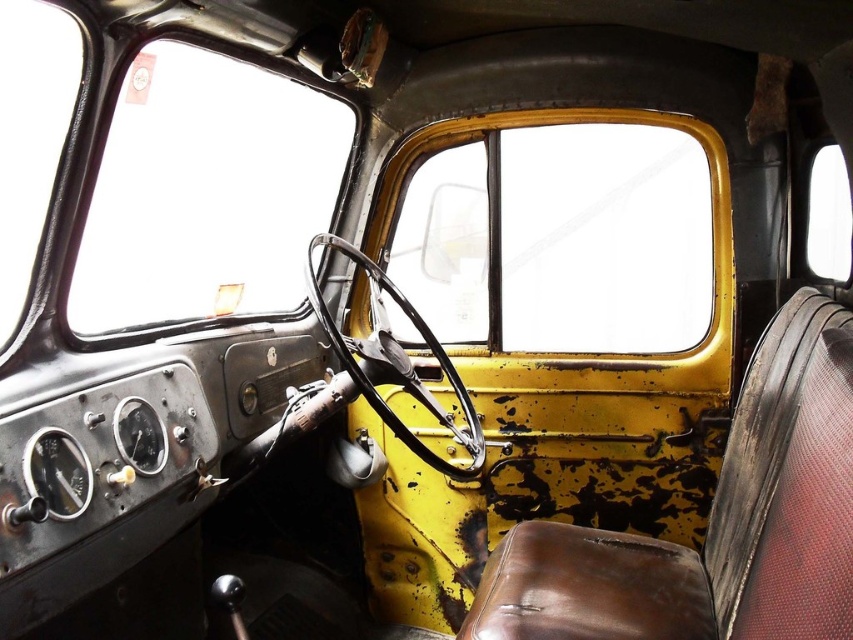
You are a passenger in the vintage truck and want to look outside. Which window, the yellow metallic window at center or the transparent glass window at upper right, offers a larger viewing area?

The yellow metallic window at center is bigger than the transparent glass window at upper right, so it offers a larger viewing area.

You are inside the vehicle shown in the image. You want to open the clear glass window at upper left to let some fresh air in. Where exactly should you reach to operate the window mechanism?

The clear glass window at upper left is located at coordinates point (206, 193), so you should reach towards that position to operate the window mechanism.

You are inside a vintage vehicle and need to locate the yellow metallic window at center. Can you tell me where the point at coordinates (x=560, y=240) is located?

The point at coordinates (x=560, y=240) is located on the yellow metallic window at center.